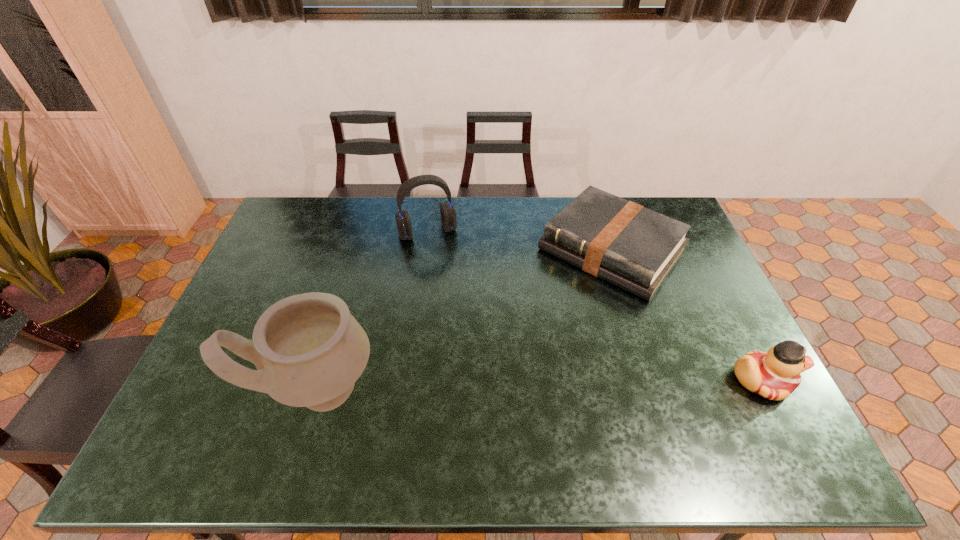
This screenshot has height=540, width=960. What are the coordinates of `free region at the near edge of the desktop` in the screenshot? It's located at (445, 399).

Where is `vacant space at the left edge`? vacant space at the left edge is located at coordinates (252, 291).

In the image, there is a desktop. Where is `vacant space at the right edge`? vacant space at the right edge is located at coordinates (702, 372).

I want to click on free space at the far left corner of the desktop, so click(x=305, y=208).

This screenshot has width=960, height=540. What are the coordinates of `vacant space at the far right corner of the desktop` in the screenshot? It's located at (677, 218).

Locate an element on the screen. The image size is (960, 540). blank region between the duck and the headset is located at coordinates click(594, 306).

At what (x,y) coordinates should I click in order to perform the action: click on unoccupied position between the duck and the third shortest object. Please return your answer as a coordinate pair (x, y). Looking at the image, I should click on (594, 306).

Identify the location of free spot between the third tallest object and the shortest object. This screenshot has width=960, height=540. (686, 315).

This screenshot has height=540, width=960. In order to click on free space that is in between the second shortest object and the shortest object in this screenshot , I will do `click(686, 315)`.

This screenshot has height=540, width=960. In order to click on free spot between the tallest object and the duck in this screenshot , I will do `click(540, 384)`.